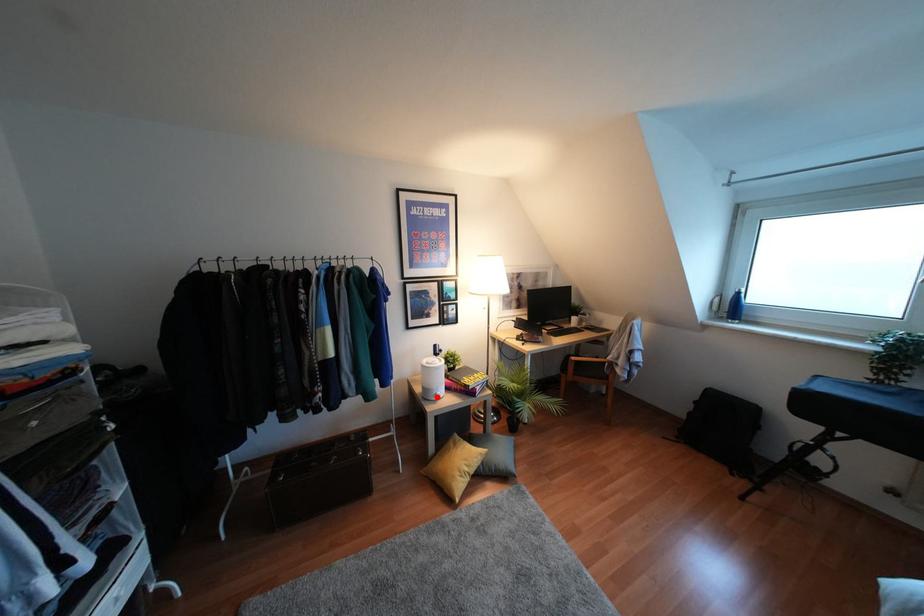
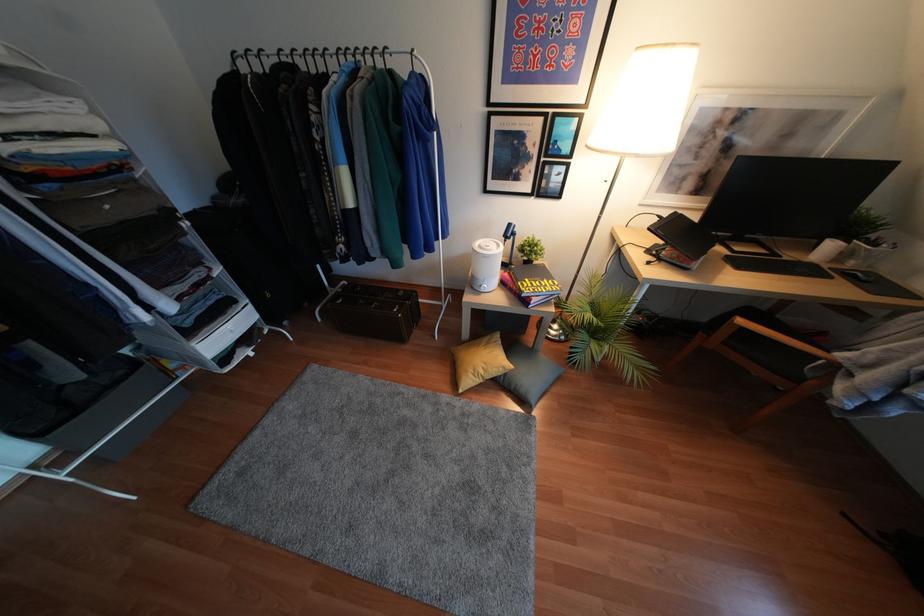
Question: A red point is marked in image1. In image2, is the corresponding 3D point closer to the camera or farther? Reply with the corresponding letter.

Choices:
 (A) The corresponding 3D point is closer.
 (B) The corresponding 3D point is farther.

Answer: (A)